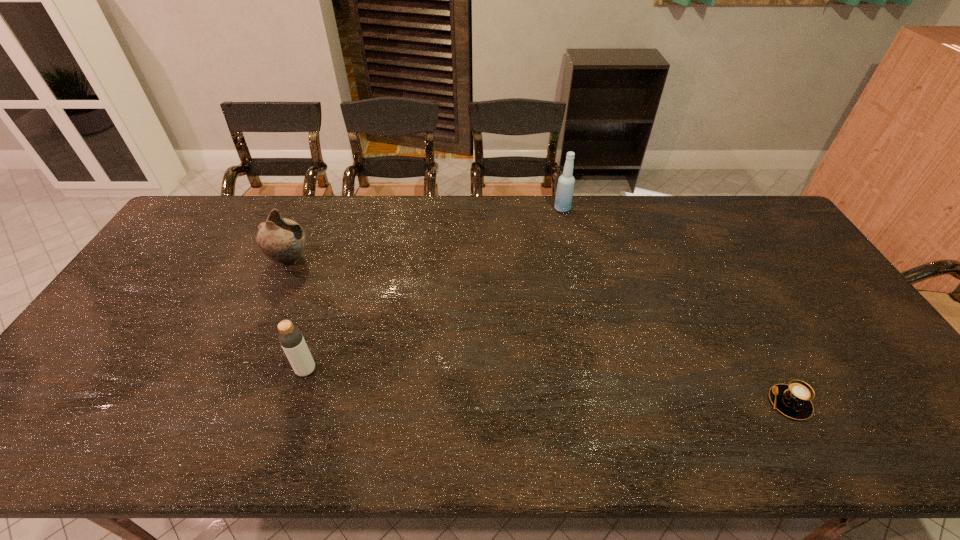
This screenshot has height=540, width=960. Find the location of `free space in the image that satisfies the following two spatial constraints: 1. from the spout of the leftmost object; 2. on the left side of the rightmost object`. free space in the image that satisfies the following two spatial constraints: 1. from the spout of the leftmost object; 2. on the left side of the rightmost object is located at coordinates (226, 403).

Where is `vacant space that satisfies the following two spatial constraints: 1. on the back side of the shortest object; 2. from the spout of the pottery`? Image resolution: width=960 pixels, height=540 pixels. vacant space that satisfies the following two spatial constraints: 1. on the back side of the shortest object; 2. from the spout of the pottery is located at coordinates (711, 260).

At what (x,y) coordinates should I click in order to perform the action: click on vacant point that satisfies the following two spatial constraints: 1. from the spout of the pottery; 2. on the right side of the left bottle. Please return your answer as a coordinate pair (x, y). The height and width of the screenshot is (540, 960). Looking at the image, I should click on (240, 370).

Find the location of `vacant space that satisfies the following two spatial constraints: 1. from the spout of the shorter bottle; 2. on the right side of the pottery`. vacant space that satisfies the following two spatial constraints: 1. from the spout of the shorter bottle; 2. on the right side of the pottery is located at coordinates (240, 370).

Locate an element on the screen. free point that satisfies the following two spatial constraints: 1. from the spout of the shorter bottle; 2. on the right side of the third nearest object is located at coordinates (240, 370).